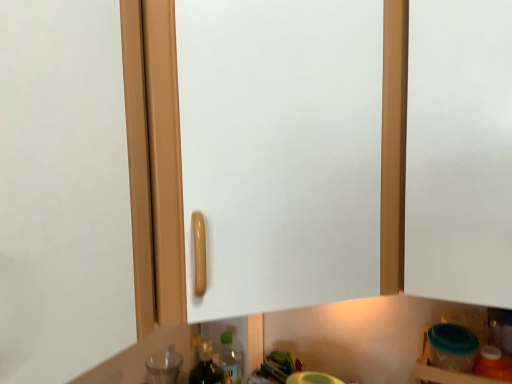
Question: Could you tell me if translucent orange bottle at lower right, the 1th bottle viewed from the front, is facing transparent glass bottle at lower left, which ranks as the 1th bottle in back-to-front order?

Choices:
 (A) yes
 (B) no

Answer: (B)

Question: Is translucent orange bottle at lower right, arranged as the second bottle when viewed from the back, positioned beyond the bounds of transparent glass bottle at lower left, marked as the second bottle in a front-to-back arrangement?

Choices:
 (A) no
 (B) yes

Answer: (B)

Question: Can you confirm if translucent orange bottle at lower right, arranged as the second bottle when viewed from the back, is taller than transparent glass bottle at lower left, marked as the second bottle in a front-to-back arrangement?

Choices:
 (A) no
 (B) yes

Answer: (A)

Question: Are translucent orange bottle at lower right, the 1th bottle positioned from the right, and transparent glass bottle at lower left, the first bottle viewed from the left, beside each other?

Choices:
 (A) yes
 (B) no

Answer: (B)

Question: From the image's perspective, is translucent orange bottle at lower right, arranged as the second bottle when viewed from the back, on top of transparent glass bottle at lower left, marked as the second bottle in a front-to-back arrangement?

Choices:
 (A) yes
 (B) no

Answer: (A)

Question: Considering the relative sizes of translucent orange bottle at lower right, the 1th bottle viewed from the front, and transparent glass bottle at lower left, marked as the second bottle in a front-to-back arrangement, in the image provided, is translucent orange bottle at lower right, the 1th bottle viewed from the front, bigger than transparent glass bottle at lower left, marked as the second bottle in a front-to-back arrangement,?

Choices:
 (A) no
 (B) yes

Answer: (A)

Question: From a real-world perspective, is transparent glass bottle at lower left, marked as the second bottle in a front-to-back arrangement, positioned under translucent orange bottle at lower right, the second bottle in the left-to-right sequence, based on gravity?

Choices:
 (A) no
 (B) yes

Answer: (B)

Question: Is transparent glass bottle at lower left, which appears as the 2th bottle when viewed from the right, to the right of translucent orange bottle at lower right, arranged as the second bottle when viewed from the back, from the viewer's perspective?

Choices:
 (A) no
 (B) yes

Answer: (A)

Question: Considering the relative sizes of transparent glass bottle at lower left, which appears as the 2th bottle when viewed from the right, and translucent orange bottle at lower right, the 1th bottle positioned from the right, in the image provided, is transparent glass bottle at lower left, which appears as the 2th bottle when viewed from the right, smaller than translucent orange bottle at lower right, the 1th bottle positioned from the right,?

Choices:
 (A) yes
 (B) no

Answer: (B)

Question: From the image's perspective, is transparent glass bottle at lower left, the first bottle viewed from the left, beneath translucent orange bottle at lower right, the 1th bottle positioned from the right?

Choices:
 (A) no
 (B) yes

Answer: (B)

Question: Can you confirm if transparent glass bottle at lower left, which ranks as the 1th bottle in back-to-front order, is shorter than translucent orange bottle at lower right, arranged as the second bottle when viewed from the back?

Choices:
 (A) no
 (B) yes

Answer: (A)

Question: Is transparent glass bottle at lower left, marked as the second bottle in a front-to-back arrangement, at the left side of translucent orange bottle at lower right, the second bottle in the left-to-right sequence?

Choices:
 (A) yes
 (B) no

Answer: (A)

Question: Considering the positions of translucent orange bottle at lower right, the 1th bottle viewed from the front, and transparent glass bottle at lower left, marked as the second bottle in a front-to-back arrangement, in the image, is translucent orange bottle at lower right, the 1th bottle viewed from the front, wider or thinner than transparent glass bottle at lower left, marked as the second bottle in a front-to-back arrangement,?

Choices:
 (A) wide
 (B) thin

Answer: (B)